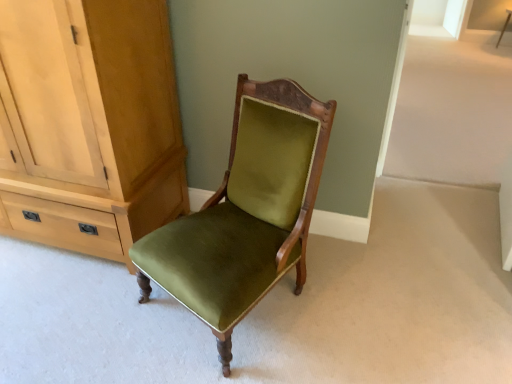
Question: Are matte wood cabinet at left and velvet green chair at center located far from each other?

Choices:
 (A) yes
 (B) no

Answer: (B)

Question: From the image's perspective, is matte wood cabinet at left beneath velvet green chair at center?

Choices:
 (A) yes
 (B) no

Answer: (B)

Question: Does matte wood cabinet at left appear on the left side of velvet green chair at center?

Choices:
 (A) yes
 (B) no

Answer: (A)

Question: Does matte wood cabinet at left have a smaller size compared to velvet green chair at center?

Choices:
 (A) yes
 (B) no

Answer: (B)

Question: Does matte wood cabinet at left lie in front of velvet green chair at center?

Choices:
 (A) no
 (B) yes

Answer: (A)

Question: Considering the relative positions of matte wood cabinet at left and velvet green chair at center in the image provided, is matte wood cabinet at left to the right of velvet green chair at center from the viewer's perspective?

Choices:
 (A) yes
 (B) no

Answer: (B)

Question: From a real-world perspective, does wooden side table at upper right sit lower than velvet green chair at center?

Choices:
 (A) no
 (B) yes

Answer: (B)

Question: From the image's perspective, is wooden side table at upper right on top of velvet green chair at center?

Choices:
 (A) no
 (B) yes

Answer: (B)

Question: Could velvet green chair at center be considered to be inside wooden side table at upper right?

Choices:
 (A) no
 (B) yes

Answer: (A)

Question: From a real-world perspective, is wooden side table at upper right located higher than velvet green chair at center?

Choices:
 (A) yes
 (B) no

Answer: (B)

Question: Is wooden side table at upper right taller than velvet green chair at center?

Choices:
 (A) yes
 (B) no

Answer: (B)

Question: Considering the relative sizes of wooden side table at upper right and velvet green chair at center in the image provided, is wooden side table at upper right wider than velvet green chair at center?

Choices:
 (A) no
 (B) yes

Answer: (A)

Question: Does matte wood cabinet at left have a smaller size compared to wooden side table at upper right?

Choices:
 (A) no
 (B) yes

Answer: (A)